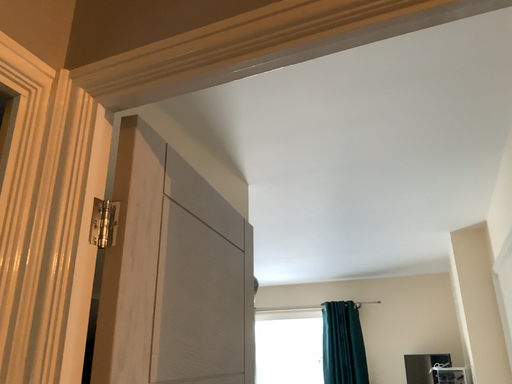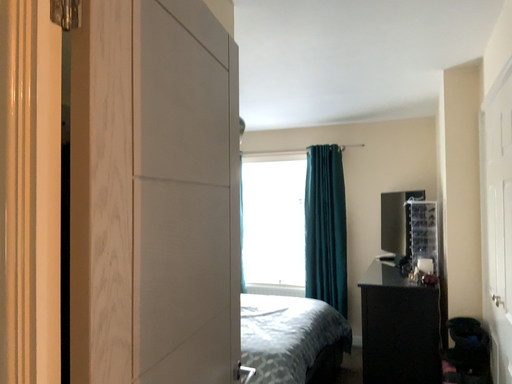
Question: Which way did the camera rotate in the video?

Choices:
 (A) rotated downward
 (B) rotated upward

Answer: (A)